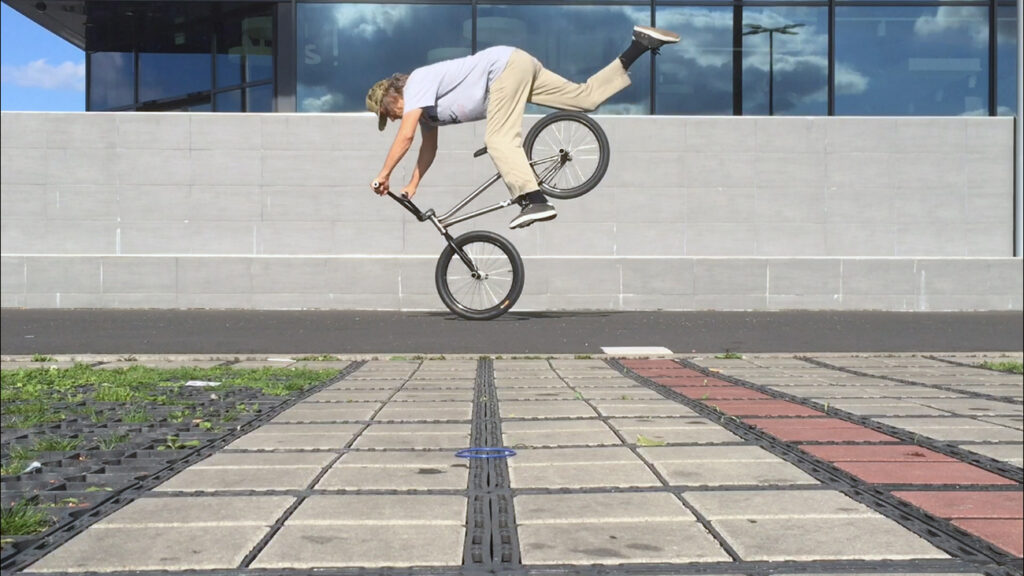
Find the location of a particular element. glass window is located at coordinates (800, 56).